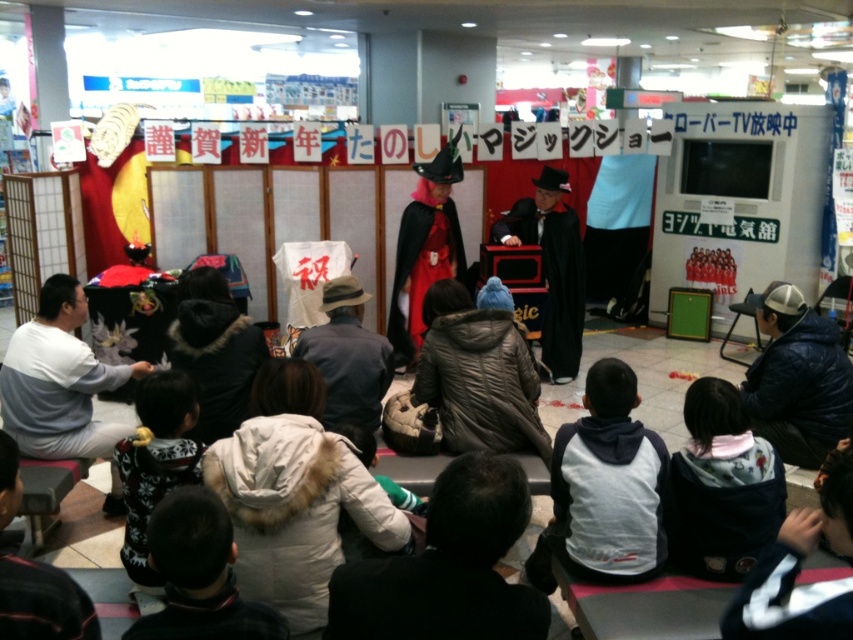
You are a photographer at the event and need to capture both the fluffy pink hoodie at lower right and the fluffy white sweater at lower left in a single frame. Considering their sizes, which one should you focus on to ensure both are visible without zooming in?

The fluffy pink hoodie at lower right is smaller in size compared to the fluffy white sweater at lower left. To capture both in a single frame without zooming in, focus on the fluffy white sweater at lower left as the primary subject, allowing the smaller fluffy pink hoodie at lower right to remain visible in the background.